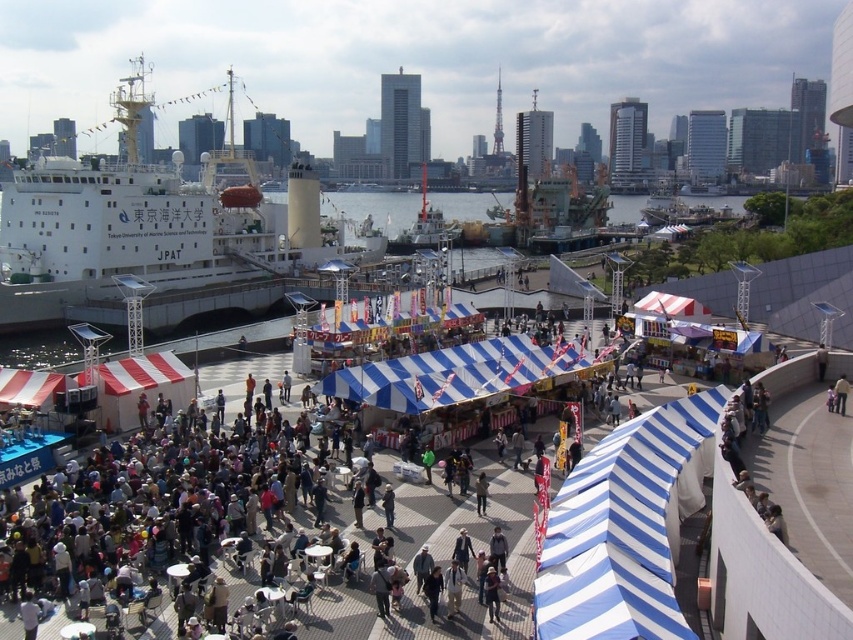
Based on the photo, you are a boat operator who needs to navigate a new vessel into the dock. The dock can only accommodate ships narrower than 10 meters. You observe the white matte ship at left and the metallic gray ship at center. Based on their widths, which ship would you prioritize docking first if you want to ensure the new vessel can fit afterward?

The white matte ship at left might be wider than metallic gray ship at center. Therefore, you should prioritize moving the white matte ship at left first to make space for the narrower metallic gray ship at center, ensuring there is enough room for the new vessel afterward.

You are standing at the center of the image. Which direction should you move to reach the white matte ship at left?

Since the white matte ship at left is located at point 0.353 on the x axis and 0.178 on the y axis, you should move to the left and slightly downward to reach it from the center of the image.